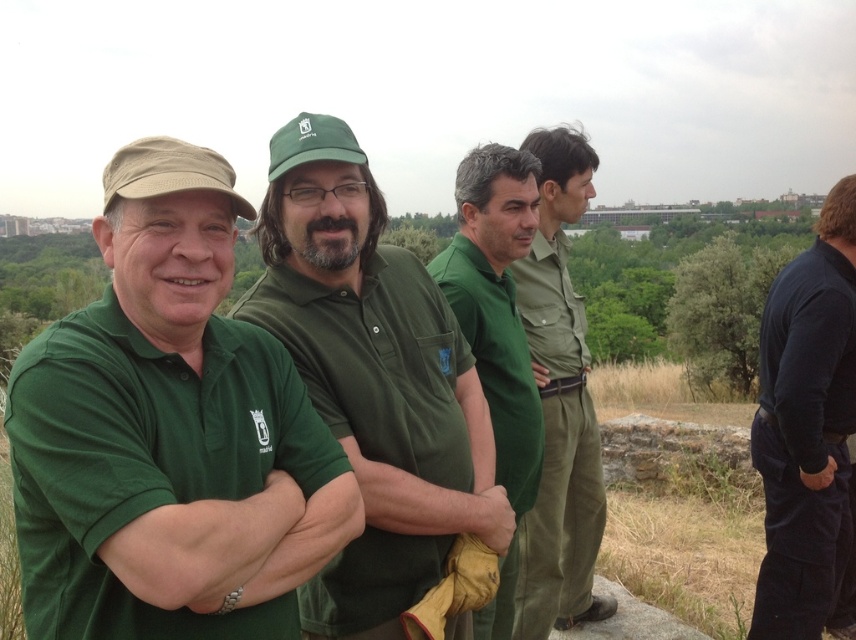
You are a photographer trying to capture a clear photo of the dark blue fabric pants at right. However, the matte green polo shirt at left is blocking your view. Can you move the polo shirt to the side so you can take the photo?

The matte green polo shirt at left is in front of the dark blue fabric pants at right, so moving the polo shirt to the side would allow you to take a clear photo of the dark blue fabric pants at right.

You are trying to determine which clothing item is wider between the matte green polo shirt at left and the green cotton shirt at center. Which one is wider?

The matte green polo shirt at left is wider than the green cotton shirt at center.

Consider the image. You are a photographer trying to capture a group photo of the matte green polo shirt at left and the dark blue fabric pants at right. Since you want both subjects to appear equally tall in the photo, which one should you position closer to the camera?

The matte green polo shirt at left has a lesser height compared to dark blue fabric pants at right, so you should position the matte green polo shirt at left closer to the camera to make them appear the same height.